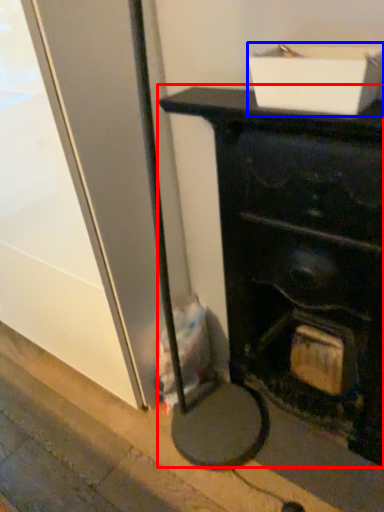
Question: Which object appears farthest to the camera in this image, furniture (highlighted by a red box) or cardboard box (highlighted by a blue box)?

Choices:
 (A) furniture
 (B) cardboard box

Answer: (B)